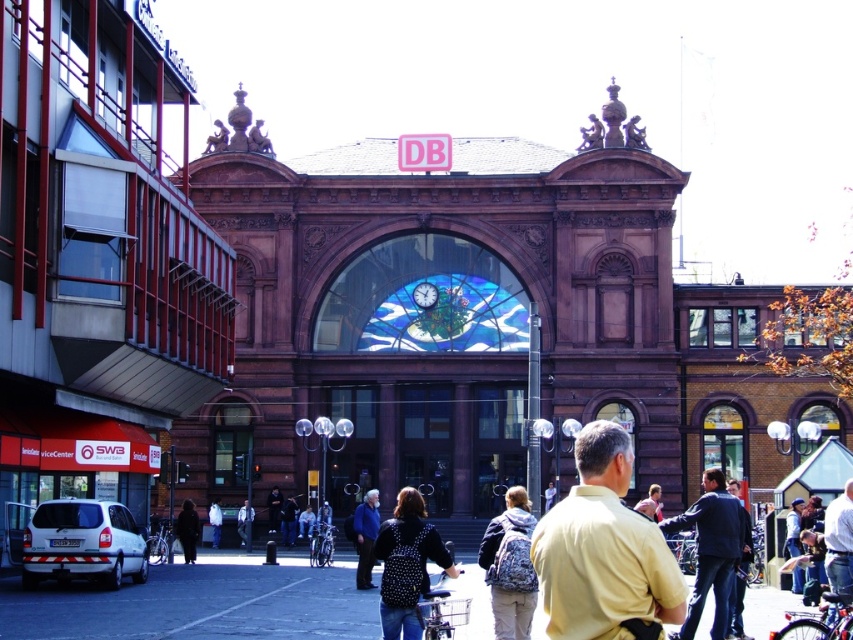
You are standing in front of the historic building and notice a dark blue jacket at center and a metallic blue clock at center. Which object is nearer to you?

The dark blue jacket at center is closer to the viewer than the metallic blue clock at center.